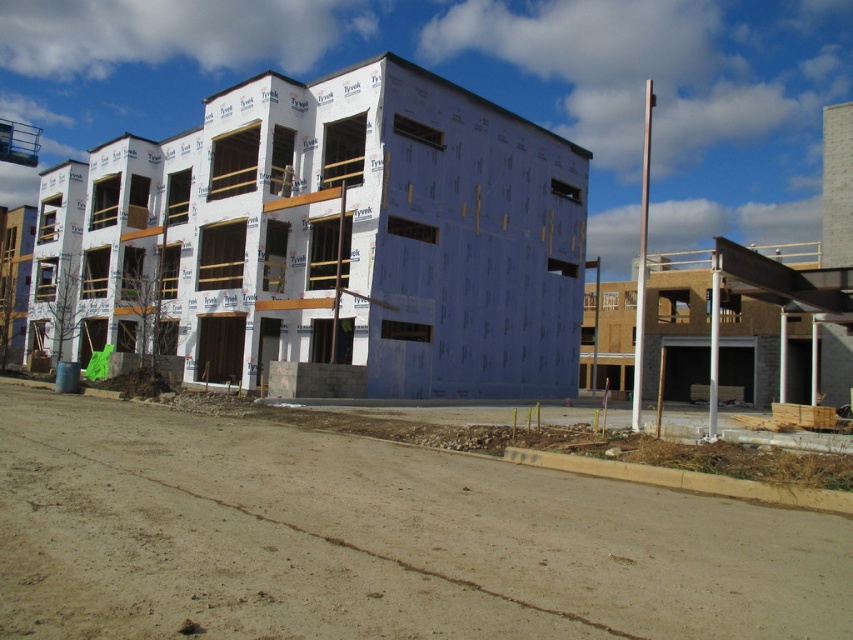
Which is below, brown dirt track at lower center or white/textured siding building at center?

brown dirt track at lower center is lower down.

Between point (20, 515) and point (541, 211), which one is positioned in front?

Point (20, 515)

The image size is (853, 640). What are the coordinates of `brown dirt track at lower center` in the screenshot? It's located at (375, 540).